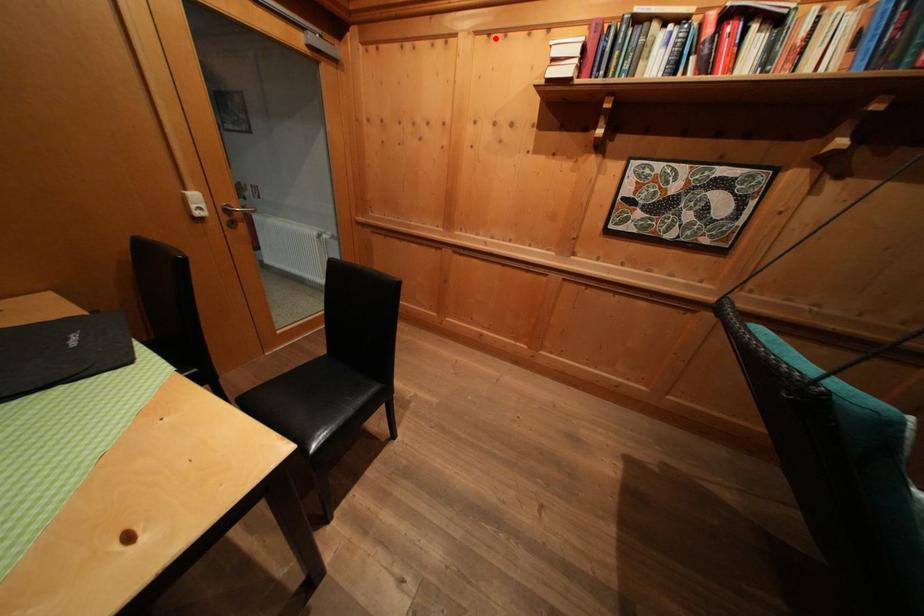
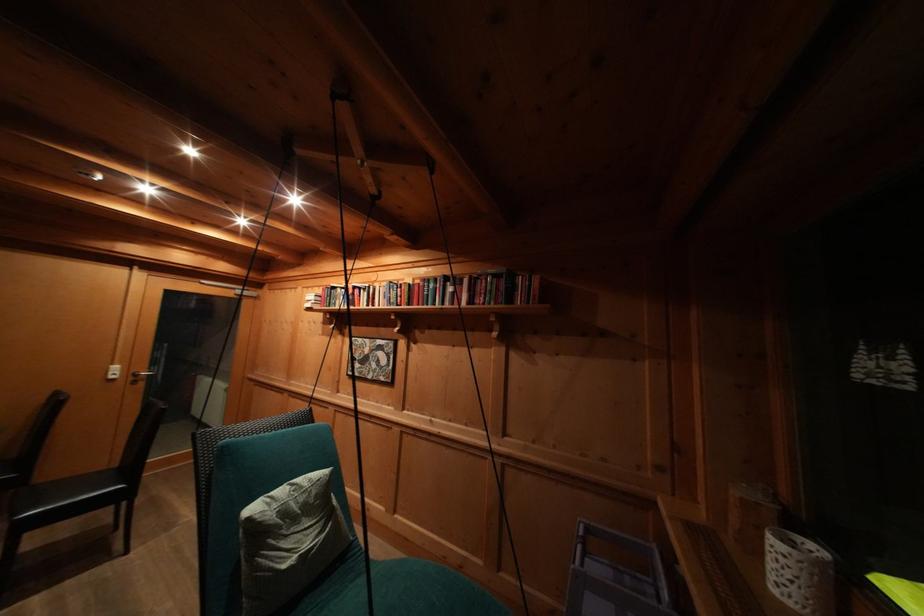
Find the pixel in the second image that matches the highlighted location in the first image.

(313, 293)